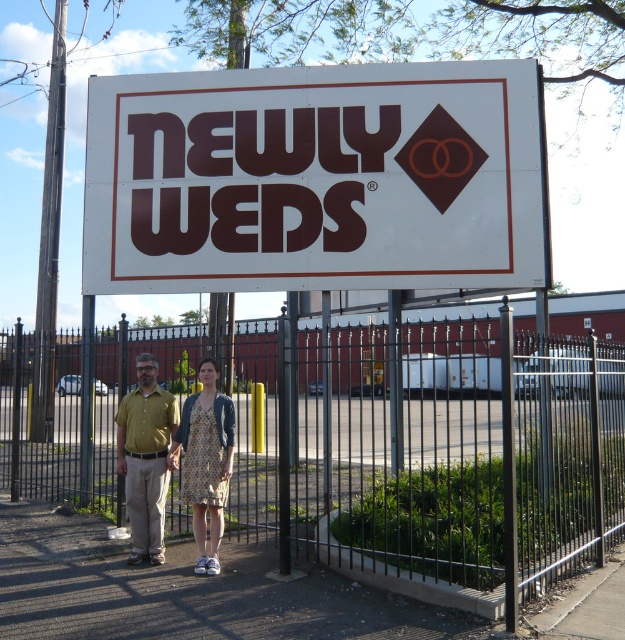
Question: Which point is closer to the camera?

Choices:
 (A) yellow-green shirt at center
 (B) black metal fence at center
 (C) printed fabric dress at center

Answer: (B)

Question: Estimate the real-world distances between objects in this image. Which object is farther from the black metal fence at center?

Choices:
 (A) white plastic sign at center
 (B) yellow-green shirt at center

Answer: (A)

Question: Is white plastic sign at center positioned in front of printed fabric dress at center?

Choices:
 (A) yes
 (B) no

Answer: (B)

Question: Is black metal fence at center to the right of printed fabric dress at center from the viewer's perspective?

Choices:
 (A) no
 (B) yes

Answer: (B)

Question: Which object is positioned farthest from the black metal fence at center?

Choices:
 (A) printed fabric dress at center
 (B) yellow-green shirt at center

Answer: (B)

Question: Is the position of yellow-green shirt at center more distant than that of printed fabric dress at center?

Choices:
 (A) yes
 (B) no

Answer: (A)